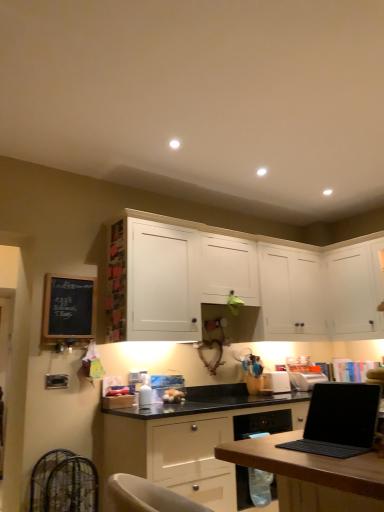
What is the approximate height of white plastic toaster at center?

white plastic toaster at center is 7.69 inches tall.

Find the location of `white matte cabinet at center, the 1th cabinetry in the top-to-bottom sequence`. white matte cabinet at center, the 1th cabinetry in the top-to-bottom sequence is located at coordinates (232, 282).

Where is `black chalkboard at left`? black chalkboard at left is located at coordinates (69, 308).

The image size is (384, 512). In order to click on white plastic toaster at center in this screenshot , I will do `click(277, 382)`.

Is matte white cabinet at center, the 1th cabinetry positioned from the bottom, thinner than white matte cabinet at center, the 1th cabinetry in the top-to-bottom sequence?

Incorrect, the width of matte white cabinet at center, the 1th cabinetry positioned from the bottom, is not less than that of white matte cabinet at center, the 1th cabinetry in the top-to-bottom sequence.

Which is behind, point (362, 415) or point (323, 255)?

Point (323, 255)

Looking at the image, does matte white cabinet at center, acting as the 3th cabinetry starting from the top, seem bigger or smaller compared to white matte cabinet at center, the third cabinetry from the bottom?

Considering their sizes, matte white cabinet at center, acting as the 3th cabinetry starting from the top, takes up more space than white matte cabinet at center, the third cabinetry from the bottom.

From the image's perspective, does matte white cabinet at center, the 1th cabinetry positioned from the bottom, appear higher than white matte cabinet at center, the third cabinetry from the bottom?

No, from the image's perspective, matte white cabinet at center, the 1th cabinetry positioned from the bottom, is not above white matte cabinet at center, the third cabinetry from the bottom.

Is white plastic toaster at center in front of white matte cabinet at center, the 1th cabinetry in the top-to-bottom sequence?

That is False.

You are a GUI agent. You are given a task and a screenshot of the screen. Output one action in this format:
    pyautogui.click(x=<x>, y=<y>)
    Task: Click on the 1st cabinetry positioned above the white plastic toaster at center (from a real-world perspective)
    
    Given the screenshot: What is the action you would take?
    pyautogui.click(x=232, y=282)

Is white matte cabinet at center, the third cabinetry from the bottom, surrounded by white plastic toaster at center?

No, white matte cabinet at center, the third cabinetry from the bottom, is not inside white plastic toaster at center.

From the image's perspective, who appears lower, white plastic toaster at center or white matte cabinet at center, the 1th cabinetry in the top-to-bottom sequence?

From the image's view, white plastic toaster at center is below.

Considering the sizes of wooden photo frame at upper center and white matte cabinet at center, the third cabinetry from the bottom, in the image, is wooden photo frame at upper center wider or thinner than white matte cabinet at center, the third cabinetry from the bottom,?

Clearly, wooden photo frame at upper center has less width compared to white matte cabinet at center, the third cabinetry from the bottom.

Considering the relative positions of wooden photo frame at upper center and white matte cabinet at center, the third cabinetry from the bottom, in the image provided, is wooden photo frame at upper center to the left or to the right of white matte cabinet at center, the third cabinetry from the bottom,?

From the image, it's evident that wooden photo frame at upper center is to the left of white matte cabinet at center, the third cabinetry from the bottom.

Which is correct: wooden photo frame at upper center is inside white matte cabinet at center, the 1th cabinetry in the top-to-bottom sequence, or outside of it?

The correct answer is: inside.

Would you consider wooden photo frame at upper center to be distant from white matte cabinet at center, the third cabinetry from the bottom?

No, wooden photo frame at upper center is in close proximity to white matte cabinet at center, the third cabinetry from the bottom.

Who is more distant, black chalkboard at left or white plastic toaster at center?

white plastic toaster at center is further away from the camera.

Is point (57, 300) positioned behind point (269, 381)?

No, (57, 300) is in front of (269, 381).

Is black chalkboard at left next to white plastic toaster at center?

black chalkboard at left and white plastic toaster at center are not in contact.

Is black chalkboard at left facing towards white plastic toaster at center?

No, black chalkboard at left is not turned towards white plastic toaster at center.

Consider the image. Between wooden photo frame at upper center and white matte cabinet at upper right, placed as the 2th cabinetry when sorted from bottom to top, which one appears on the left side from the viewer's perspective?

Positioned to the left is wooden photo frame at upper center.

Is wooden photo frame at upper center positioned behind white matte cabinet at upper right, which is the 2th cabinetry in top-to-bottom order?

That is False.

Do you think wooden photo frame at upper center is within white matte cabinet at upper right, placed as the 2th cabinetry when sorted from bottom to top, or outside of it?

The correct answer is: outside.

From the image's perspective, is wooden photo frame at upper center above or below white matte cabinet at upper right, placed as the 2th cabinetry when sorted from bottom to top?

wooden photo frame at upper center is above white matte cabinet at upper right, placed as the 2th cabinetry when sorted from bottom to top.

Is white plastic toaster at center in contact with black matte laptop at lower right?

No.

Based on their sizes in the image, would you say white plastic toaster at center is bigger or smaller than black matte laptop at lower right?

white plastic toaster at center is smaller than black matte laptop at lower right.

Considering the sizes of white plastic toaster at center and black matte laptop at lower right in the image, is white plastic toaster at center taller or shorter than black matte laptop at lower right?

In the image, white plastic toaster at center appears to be shorter than black matte laptop at lower right.

Considering the sizes of objects white plastic toaster at center and black matte laptop at lower right in the image provided, who is wider, white plastic toaster at center or black matte laptop at lower right?

black matte laptop at lower right is wider.

Which is more to the right, matte white cabinet at center, the 1th cabinetry positioned from the bottom, or white plastic toaster at center?

white plastic toaster at center.

Image resolution: width=384 pixels, height=512 pixels. In order to click on appliance above the matte white cabinet at center, acting as the 3th cabinetry starting from the top (from the image's perspective) in this screenshot , I will do `click(277, 382)`.

Measure the distance from matte white cabinet at center, acting as the 3th cabinetry starting from the top, to white plastic toaster at center.

A distance of 3.83 feet exists between matte white cabinet at center, acting as the 3th cabinetry starting from the top, and white plastic toaster at center.

In the image, there is a white matte cabinet at center, the 1th cabinetry in the top-to-bottom sequence. Where is `cabinetry below it (from a real-world perspective)`? The height and width of the screenshot is (512, 384). cabinetry below it (from a real-world perspective) is located at coordinates (262, 454).

Find the location of a particular element. The height and width of the screenshot is (512, 384). appliance lying on the right of white matte cabinet at center, the 1th cabinetry in the top-to-bottom sequence is located at coordinates (277, 382).

When comparing their distances from black matte laptop at lower right, does white matte cabinet at upper right, which is the 2th cabinetry in top-to-bottom order, or matte white cabinet at center, acting as the 3th cabinetry starting from the top, seem further?

Among the two, white matte cabinet at upper right, which is the 2th cabinetry in top-to-bottom order, is located further to black matte laptop at lower right.

Looking at the image, which one is located closer to black chalkboard at left, white matte cabinet at upper right, which is the 2th cabinetry in top-to-bottom order, or matte white cabinet at center, the 1th cabinetry positioned from the bottom?

matte white cabinet at center, the 1th cabinetry positioned from the bottom, is positioned closer to the anchor black chalkboard at left.

In the scene shown: Estimate the real-world distances between objects in this image. Which object is closer to wooden photo frame at upper center, white matte cabinet at center, the 1th cabinetry in the top-to-bottom sequence, or matte white cabinet at center, acting as the 3th cabinetry starting from the top?

white matte cabinet at center, the 1th cabinetry in the top-to-bottom sequence.

Based on their spatial positions, is matte white cabinet at center, the 1th cabinetry positioned from the bottom, or white matte cabinet at upper right, which is the 2th cabinetry in top-to-bottom order, closer to white matte cabinet at center, the third cabinetry from the bottom?

white matte cabinet at upper right, which is the 2th cabinetry in top-to-bottom order.

Estimate the real-world distances between objects in this image. Which object is further from white matte cabinet at upper right, which is the 2th cabinetry in top-to-bottom order, matte white cabinet at center, the 1th cabinetry positioned from the bottom, or black chalkboard at left?

black chalkboard at left lies further to white matte cabinet at upper right, which is the 2th cabinetry in top-to-bottom order, than the other object.

Based on the photo, looking at the image, which one is located closer to wooden photo frame at upper center, white plastic toaster at center or black matte laptop at lower right?

The object closer to wooden photo frame at upper center is white plastic toaster at center.

Looking at the image, which one is located closer to black matte laptop at lower right, wooden photo frame at upper center or white matte cabinet at upper right, placed as the 2th cabinetry when sorted from bottom to top?

wooden photo frame at upper center lies closer to black matte laptop at lower right than the other object.

In the scene shown: Looking at the image, which one is located further to white matte cabinet at center, the 1th cabinetry in the top-to-bottom sequence, wooden photo frame at upper center or white plastic toaster at center?

Among the two, white plastic toaster at center is located further to white matte cabinet at center, the 1th cabinetry in the top-to-bottom sequence.

At what (x,y) coordinates should I click in order to perform the action: click on shelf situated between black chalkboard at left and matte white cabinet at center, the 1th cabinetry positioned from the bottom, from left to right. Please return your answer as a coordinate pair (x, y). The height and width of the screenshot is (512, 384). Looking at the image, I should click on (116, 283).

The image size is (384, 512). What are the coordinates of `shelf located between black chalkboard at left and white plastic toaster at center in the left-right direction` in the screenshot? It's located at (116, 283).

The width and height of the screenshot is (384, 512). I want to click on cabinetry between black chalkboard at left and matte white cabinet at center, acting as the 3th cabinetry starting from the top, so click(x=232, y=282).

This screenshot has width=384, height=512. I want to click on shelf between black chalkboard at left and white matte cabinet at upper right, which is the 2th cabinetry in top-to-bottom order, from left to right, so click(x=116, y=283).